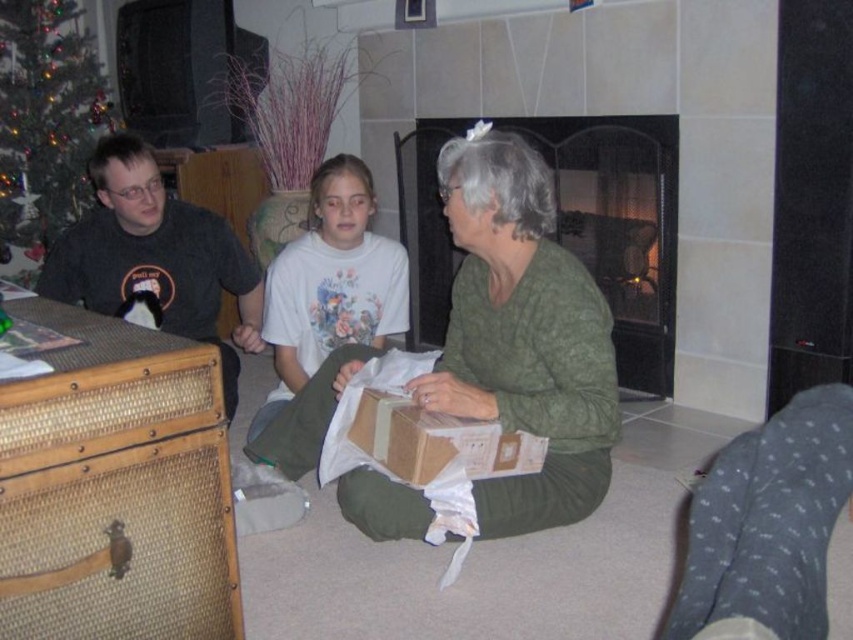
You are standing in the room and want to place a small decoration on the floor near the gray dotted socks at lower right. Can you confirm if the white cotton shirt at center is blocking access to that area?

The gray dotted socks at lower right is below white cotton shirt at center, meaning the white cotton shirt at center is above it. Therefore, the white cotton shirt at center is blocking access to the area near the gray dotted socks at lower right.

You are planning to place a new 3 feet wide decorative item between the green textured sweater at center and the green matte christmas tree at left. Based on the current distance between them, will there be enough space for the decorative item without moving either object?

The distance between the green textured sweater at center and the green matte christmas tree at left is 9.47 feet. Since the decorative item is 3 feet wide, there is sufficient space as 9.47 feet is greater than 3 feet.

You are organizing a holiday photo shoot and need to ensure that the green textured sweater at center and the green matte christmas tree at left are both visible in the frame. Based on their sizes, which object should you prioritize positioning closer to the camera to ensure both are clearly visible?

The green textured sweater at center should be positioned closer to the camera since it occupies less space than the green matte christmas tree at left, making it smaller in size and requiring closer framing for visibility.